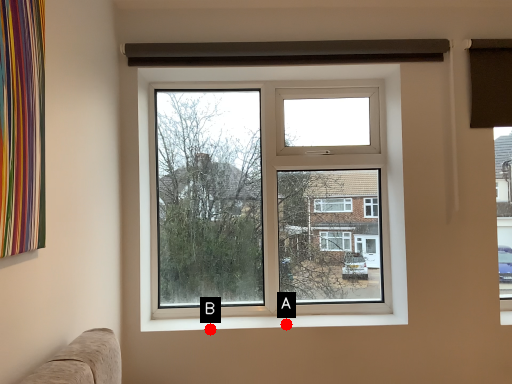
Question: Two points are circled on the image, labeled by A and B beside each circle. Which of the following is the farthest from the observer?

Choices:
 (A) A is further
 (B) B is further

Answer: (A)